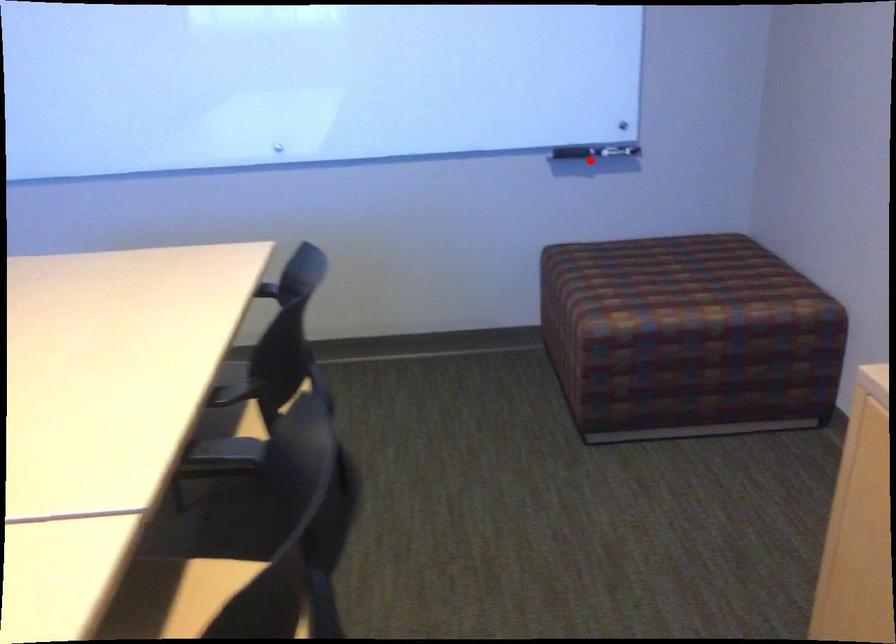
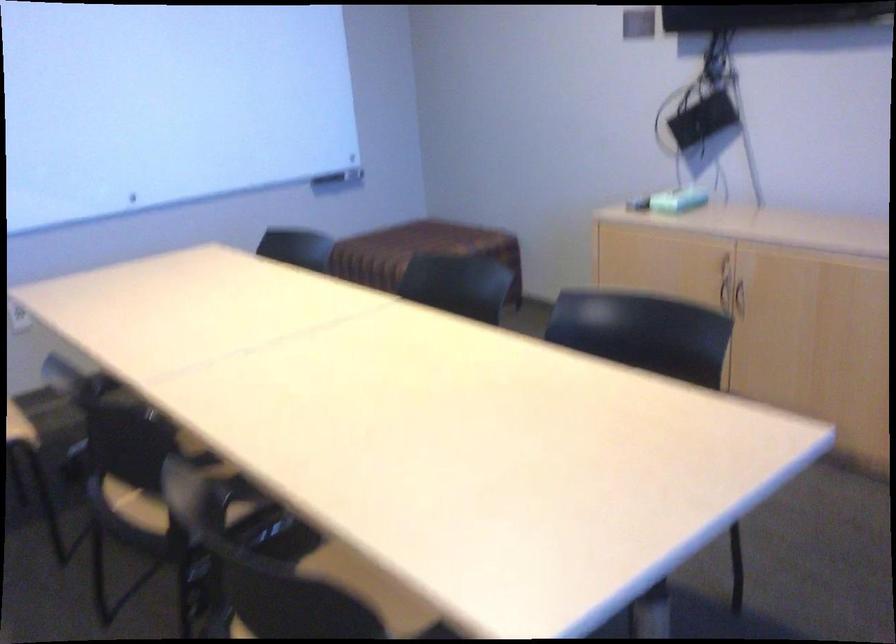
Question: I am providing you with two images of the same scene from different viewpoints. Given a red point in image1, look at the same physical point in image2. Is it:

Choices:
 (A) Closer to the viewpoint
 (B) Farther from the viewpoint

Answer: (B)